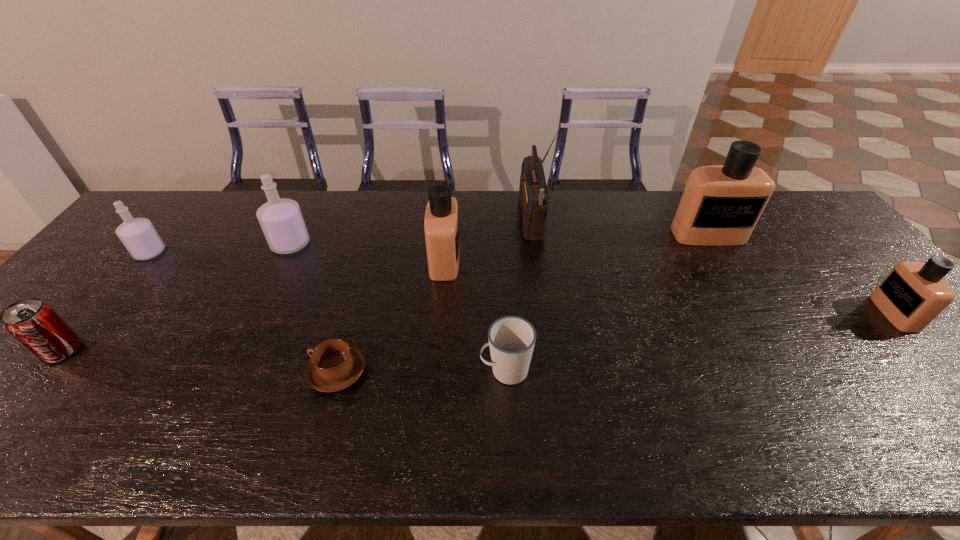
This screenshot has height=540, width=960. I want to click on free space between the white cup and the brown cappuccino, so click(421, 371).

This screenshot has height=540, width=960. I want to click on free space that is in between the biggest beige perfume and the nearest beige perfume, so click(801, 274).

Locate an element on the screen. Image resolution: width=960 pixels, height=540 pixels. the fifth closest object to the leftmost beige perfume is located at coordinates (721, 204).

Select which object appears as the closest to the brown cappuccino. Please provide its 2D coordinates. Your answer should be formatted as a tuple, i.e. [(x, y)], where the tuple contains the x and y coordinates of a point satisfying the conditions above.

[(441, 224)]

At what (x,y) coordinates should I click in order to perform the action: click on perfume object that ranks as the fourth closest to the sixth object from right to left. Please return your answer as a coordinate pair (x, y). This screenshot has height=540, width=960. Looking at the image, I should click on (721, 204).

This screenshot has height=540, width=960. What are the coordinates of `perfume that is the fourth closest to the tallest object` in the screenshot? It's located at (913, 294).

Where is `beige perfume object that ranks as the third closest to the radio receiver`? The width and height of the screenshot is (960, 540). beige perfume object that ranks as the third closest to the radio receiver is located at coordinates (913, 294).

Select which beige perfume is the closest to the red pop soda. Please provide its 2D coordinates. Your answer should be formatted as a tuple, i.e. [(x, y)], where the tuple contains the x and y coordinates of a point satisfying the conditions above.

[(441, 224)]

Find the location of a particular element. This screenshot has height=540, width=960. free space that satisfies the following two spatial constraints: 1. on the front label of the second tallest object; 2. with a handle on the side of the sixth object from left to right is located at coordinates (788, 370).